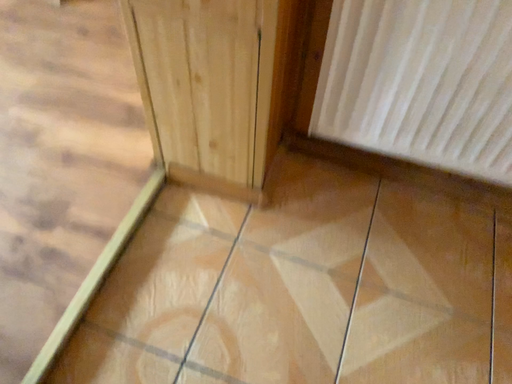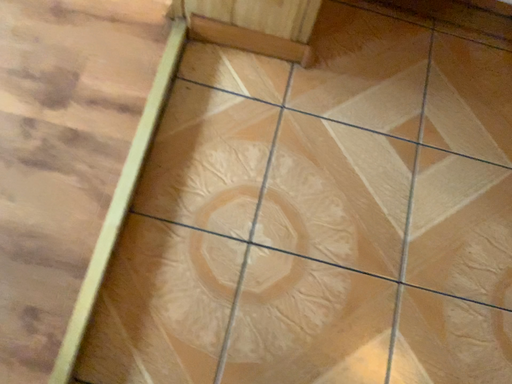
Question: Which way did the camera rotate in the video?

Choices:
 (A) rotated upward
 (B) rotated downward

Answer: (B)